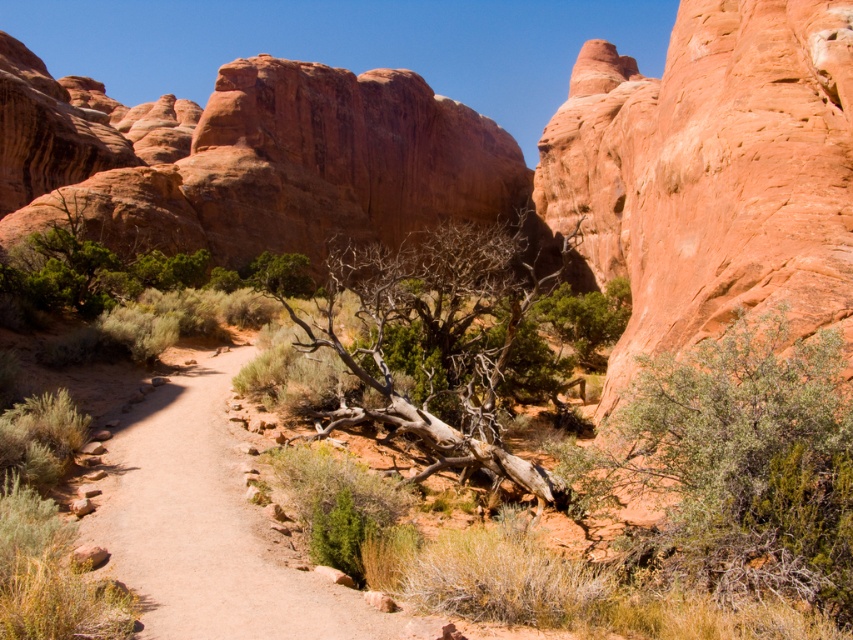
Between brown dirt path at center and dead wood at center, which one is positioned higher?

dead wood at center is higher up.

Does brown dirt path at center have a greater width compared to dead wood at center?

In fact, brown dirt path at center might be narrower than dead wood at center.

Measure the distance between brown dirt path at center and camera.

brown dirt path at center is 29.89 meters from camera.

Locate an element on the screen. Image resolution: width=853 pixels, height=640 pixels. brown dirt path at center is located at coordinates (209, 524).

Is point (635, 422) behind point (474, 397)?

No.

Does green leafy shrub at right have a lesser width compared to dead wood at center?

Indeed, green leafy shrub at right has a lesser width compared to dead wood at center.

Who is more distant from viewer, [647,403] or [386,372]?

Positioned behind is point [386,372].

Where is `green leafy shrub at right`? The image size is (853, 640). green leafy shrub at right is located at coordinates (740, 460).

In the scene shown: Can you confirm if green leafy shrub at right is taller than brown dirt path at center?

Correct, green leafy shrub at right is much taller as brown dirt path at center.

Does point (824, 589) come in front of point (202, 435)?

Yes, it is in front of point (202, 435).

This screenshot has width=853, height=640. I want to click on green leafy shrub at right, so click(x=740, y=460).